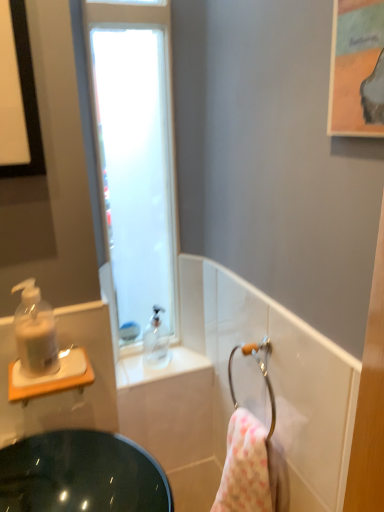
Question: From the image's perspective, does frosted glass window at upper left appear lower than translucent plastic sink at left?

Choices:
 (A) yes
 (B) no

Answer: (B)

Question: Can you confirm if frosted glass window at upper left is shorter than translucent plastic sink at left?

Choices:
 (A) no
 (B) yes

Answer: (A)

Question: Does frosted glass window at upper left have a greater height compared to translucent plastic sink at left?

Choices:
 (A) yes
 (B) no

Answer: (A)

Question: Is translucent plastic sink at left a part of frosted glass window at upper left?

Choices:
 (A) yes
 (B) no

Answer: (B)

Question: From a real-world perspective, is frosted glass window at upper left beneath translucent plastic sink at left?

Choices:
 (A) no
 (B) yes

Answer: (A)

Question: Considering the positions of transparent plastic soap dispenser at upper center, which ranks as the first soap dispenser in back-to-front order, and frosted glass window at upper left in the image, is transparent plastic soap dispenser at upper center, which ranks as the first soap dispenser in back-to-front order, wider or thinner than frosted glass window at upper left?

Choices:
 (A) thin
 (B) wide

Answer: (A)

Question: Is transparent plastic soap dispenser at upper center, the 1th soap dispenser in the right-to-left sequence, to the left or to the right of frosted glass window at upper left in the image?

Choices:
 (A) right
 (B) left

Answer: (A)

Question: From the image's perspective, is transparent plastic soap dispenser at upper center, the 2th soap dispenser viewed from the left, located above or below frosted glass window at upper left?

Choices:
 (A) above
 (B) below

Answer: (B)

Question: Is point (155, 327) positioned closer to the camera than point (147, 120)?

Choices:
 (A) closer
 (B) farther

Answer: (B)

Question: Is transparent plastic soap dispenser at upper center, the 1th soap dispenser in the right-to-left sequence, in front of or behind translucent plastic sink at left in the image?

Choices:
 (A) behind
 (B) front

Answer: (A)

Question: Is transparent plastic soap dispenser at upper center, which appears as the second soap dispenser when viewed from the front, situated inside translucent plastic sink at left or outside?

Choices:
 (A) inside
 (B) outside

Answer: (B)

Question: From the image's perspective, is transparent plastic soap dispenser at upper center, which appears as the second soap dispenser when viewed from the front, above or below translucent plastic sink at left?

Choices:
 (A) above
 (B) below

Answer: (A)

Question: Is transparent plastic soap dispenser at upper center, which ranks as the first soap dispenser in back-to-front order, bigger or smaller than translucent plastic sink at left?

Choices:
 (A) big
 (B) small

Answer: (B)

Question: In the image, is translucent plastic sink at left on the left side or the right side of transparent plastic soap dispenser at upper center, which appears as the second soap dispenser when viewed from the front?

Choices:
 (A) left
 (B) right

Answer: (A)

Question: From a real-world perspective, is translucent plastic sink at left above or below transparent plastic soap dispenser at upper center, the 1th soap dispenser in the right-to-left sequence?

Choices:
 (A) below
 (B) above

Answer: (A)